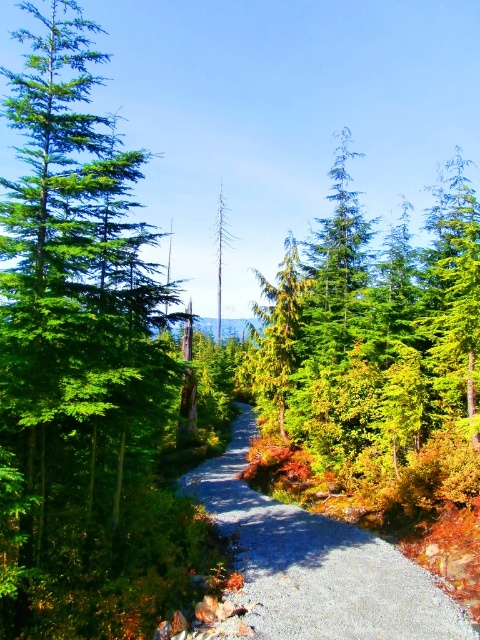
Question: Does green matte tree at center lie in front of gray gravel path at center?

Choices:
 (A) yes
 (B) no

Answer: (B)

Question: Can you confirm if green matte tree at center is positioned below gray gravel path at center?

Choices:
 (A) no
 (B) yes

Answer: (A)

Question: Is green matte tree at center smaller than gray gravel path at center?

Choices:
 (A) yes
 (B) no

Answer: (B)

Question: Among these points, which one is nearest to the camera?

Choices:
 (A) (273, 435)
 (B) (239, 440)

Answer: (A)

Question: Which point is closer to the camera?

Choices:
 (A) green matte tree at center
 (B) gray gravel path at center

Answer: (B)